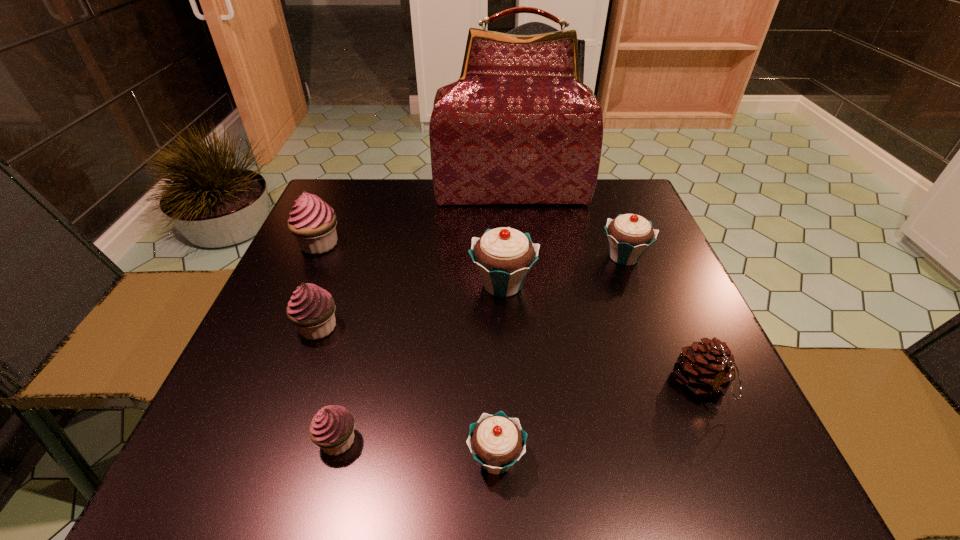
I want to click on the nearest pink cupcake, so click(332, 429).

In order to click on the smallest pink cupcake in this screenshot , I will do `click(332, 429)`.

Where is `the nearest teal cupcake`? Image resolution: width=960 pixels, height=540 pixels. the nearest teal cupcake is located at coordinates (496, 441).

The width and height of the screenshot is (960, 540). In order to click on free spot located 0.330m on the front-facing side of the farthest object in this screenshot , I will do `click(522, 291)`.

In order to click on free space located on the front of the farthest pink cupcake in this screenshot , I will do `click(267, 363)`.

At what (x,y) coordinates should I click in order to perform the action: click on vacant region located on the front of the biggest teal cupcake. Please return your answer as a coordinate pair (x, y). Looking at the image, I should click on (514, 487).

This screenshot has width=960, height=540. I want to click on vacant space located 0.110m on the back of the rightmost cupcake, so click(x=609, y=216).

I want to click on vacant area located 0.060m on the front of the second nearest pink cupcake, so click(x=302, y=370).

Locate an element on the screen. The height and width of the screenshot is (540, 960). vacant space located 0.120m with a leaf charm attached to the brown pinecone is located at coordinates (746, 490).

The image size is (960, 540). I want to click on vacant space located 0.170m on the left of the nearest pink cupcake, so click(209, 440).